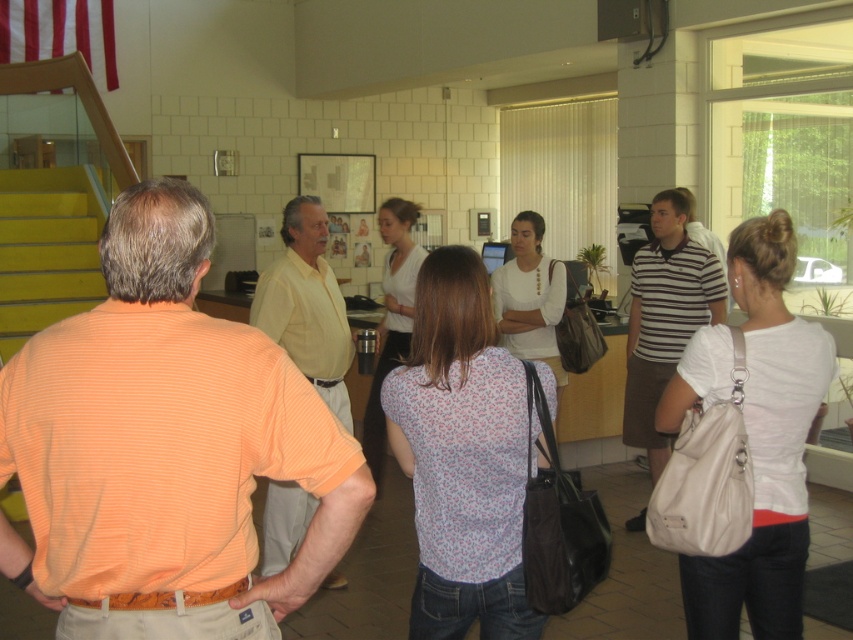
Question: Is orange striped shirt at center behind yellow smooth shirt at center?

Choices:
 (A) no
 (B) yes

Answer: (A)

Question: Which object is the farthest from the orange striped shirt at center?

Choices:
 (A) striped cotton polo shirt at center
 (B) yellow smooth shirt at center

Answer: (A)

Question: Is orange striped shirt at center to the right of striped cotton polo shirt at center from the viewer's perspective?

Choices:
 (A) no
 (B) yes

Answer: (A)

Question: Which object is farther from the camera taking this photo?

Choices:
 (A) yellow smooth shirt at center
 (B) orange striped shirt at center
 (C) striped cotton polo shirt at center

Answer: (C)

Question: Which point is closer to the camera?

Choices:
 (A) (672, 340)
 (B) (3, 460)

Answer: (B)

Question: Does orange striped shirt at center have a lesser width compared to striped cotton polo shirt at center?

Choices:
 (A) no
 (B) yes

Answer: (A)